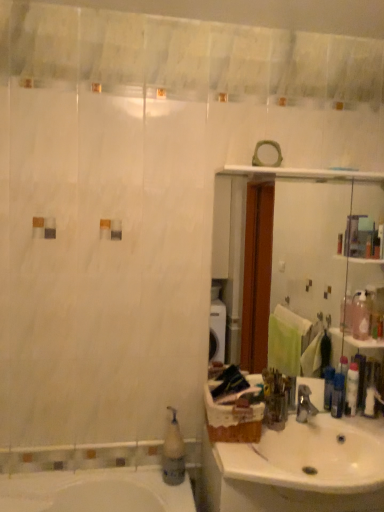
Question: Based on their sizes in the image, would you say white plastic soap dispenser at lower left is bigger or smaller than silver metallic faucet at sink right?

Choices:
 (A) big
 (B) small

Answer: (A)

Question: Is white plastic soap dispenser at lower left inside the boundaries of silver metallic faucet at sink right, or outside?

Choices:
 (A) inside
 (B) outside

Answer: (B)

Question: Estimate the real-world distances between objects in this image. Which object is closer to the silver metallic faucet at sink right?

Choices:
 (A) blue plastic bottle at sink
 (B) white ceramic sink at lower right
 (C) white plastic soap dispenser at lower left
 (D) clear glass mirror at upper center

Answer: (A)

Question: Which object is the closest to the clear glass mirror at upper center?

Choices:
 (A) white plastic soap dispenser at lower left
 (B) white ceramic sink at lower right
 (C) blue plastic bottle at sink
 (D) silver metallic faucet at sink right

Answer: (B)